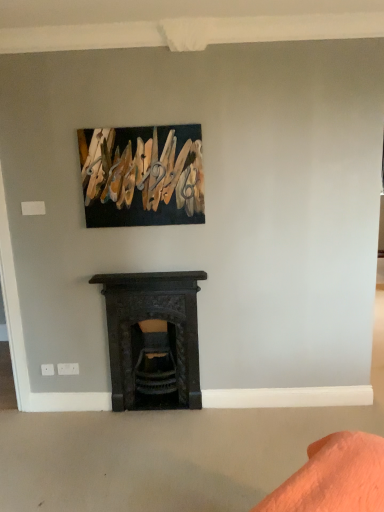
Question: In terms of height, does dark gray stone fireplace at center look taller or shorter compared to wooden clothespins at upper center?

Choices:
 (A) short
 (B) tall

Answer: (B)

Question: Do you think dark gray stone fireplace at center is within wooden clothespins at upper center, or outside of it?

Choices:
 (A) outside
 (B) inside

Answer: (A)

Question: In terms of width, does dark gray stone fireplace at center look wider or thinner when compared to wooden clothespins at upper center?

Choices:
 (A) wide
 (B) thin

Answer: (A)

Question: From the image's perspective, relative to dark gray stone fireplace at center, is wooden clothespins at upper center above or below?

Choices:
 (A) below
 (B) above

Answer: (B)

Question: From a real-world perspective, is wooden clothespins at upper center positioned above or below dark gray stone fireplace at center?

Choices:
 (A) below
 (B) above

Answer: (B)

Question: Considering the positions of wooden clothespins at upper center and dark gray stone fireplace at center in the image, is wooden clothespins at upper center taller or shorter than dark gray stone fireplace at center?

Choices:
 (A) tall
 (B) short

Answer: (B)

Question: Considering the positions of wooden clothespins at upper center and dark gray stone fireplace at center in the image, is wooden clothespins at upper center wider or thinner than dark gray stone fireplace at center?

Choices:
 (A) wide
 (B) thin

Answer: (B)